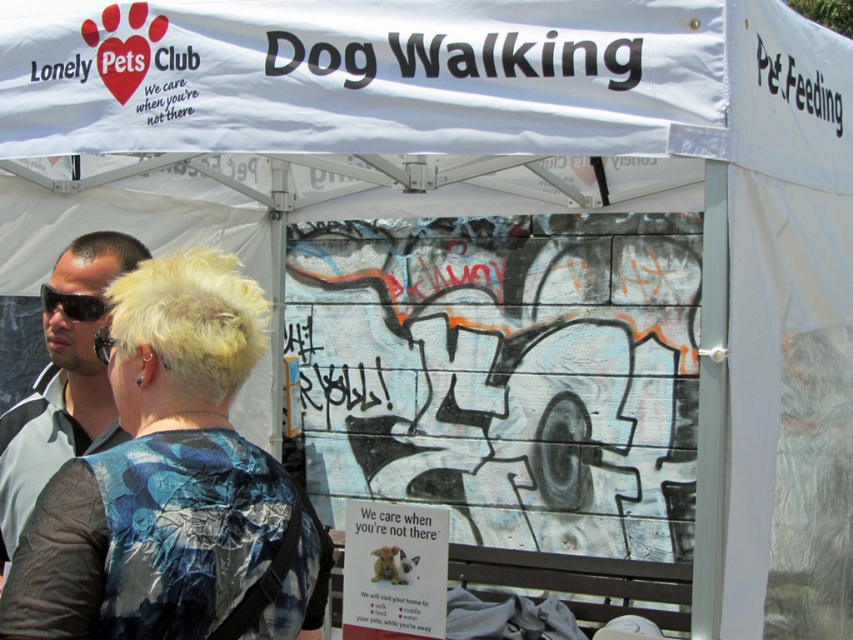
Does gray fabric shirt at left appear over black plastic sunglasses at left?

No.

Is gray fabric shirt at left to the right of black plastic sunglasses at left from the viewer's perspective?

Yes, gray fabric shirt at left is to the right of black plastic sunglasses at left.

Who is more distant from viewer, (96, 308) or (84, 305)?

Point (96, 308)

You are a GUI agent. You are given a task and a screenshot of the screen. Output one action in this format:
    pyautogui.click(x=<x>, y=<y>)
    Task: Click on the gray fabric shirt at left
    
    Given the screenshot: What is the action you would take?
    pyautogui.click(x=62, y=380)

Can you confirm if gray fabric shirt at left is positioned to the right of black plastic sign at upper right?

Incorrect, gray fabric shirt at left is not on the right side of black plastic sign at upper right.

Does gray fabric shirt at left have a lesser height compared to black plastic sign at upper right?

In fact, gray fabric shirt at left may be taller than black plastic sign at upper right.

What do you see at coordinates (62, 380) in the screenshot? I see `gray fabric shirt at left` at bounding box center [62, 380].

Where is `gray fabric shirt at left`? gray fabric shirt at left is located at coordinates (62, 380).

Where is `black plastic sign at upper right`? The height and width of the screenshot is (640, 853). black plastic sign at upper right is located at coordinates (798, 86).

Does black plastic sign at upper right appear under black plastic sunglasses at left?

Incorrect, black plastic sign at upper right is not positioned below black plastic sunglasses at left.

Who is more distant from viewer, (821, 84) or (83, 301)?

Positioned behind is point (821, 84).

You are a GUI agent. You are given a task and a screenshot of the screen. Output one action in this format:
    pyautogui.click(x=<x>, y=<y>)
    Task: Click on the black plastic sign at upper right
    
    Given the screenshot: What is the action you would take?
    pyautogui.click(x=798, y=86)